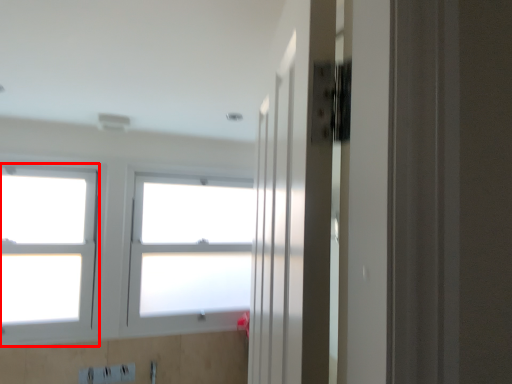
Question: From the image's perspective, what is the correct spatial relationship of window (annotated by the red box) in relation to window?

Choices:
 (A) above
 (B) below

Answer: (A)